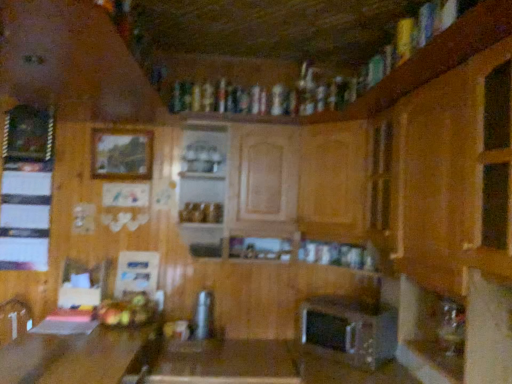
Question: Is wooden picture frame at upper left, the first picture frame in the right-to-left sequence, positioned with its back to shiny metallic fruit basket at lower center?

Choices:
 (A) yes
 (B) no

Answer: (B)

Question: Considering the relative sizes of wooden picture frame at upper left, the first picture frame in the right-to-left sequence, and shiny metallic fruit basket at lower center in the image provided, is wooden picture frame at upper left, the first picture frame in the right-to-left sequence, taller than shiny metallic fruit basket at lower center?

Choices:
 (A) no
 (B) yes

Answer: (B)

Question: From the image's perspective, does wooden picture frame at upper left, the first picture frame in the right-to-left sequence, appear lower than shiny metallic fruit basket at lower center?

Choices:
 (A) no
 (B) yes

Answer: (A)

Question: From a real-world perspective, is wooden picture frame at upper left, the first picture frame in the right-to-left sequence, physically below shiny metallic fruit basket at lower center?

Choices:
 (A) yes
 (B) no

Answer: (B)

Question: Is wooden picture frame at upper left, which is the second picture frame in left-to-right order, further to the viewer compared to shiny metallic fruit basket at lower center?

Choices:
 (A) no
 (B) yes

Answer: (B)

Question: Considering the positions of metallic silver toaster at center, placed as the first appliance when sorted from left to right, and wooden picture frame at upper left, which appears as the 2th picture frame when viewed from the right, in the image, is metallic silver toaster at center, placed as the first appliance when sorted from left to right, taller or shorter than wooden picture frame at upper left, which appears as the 2th picture frame when viewed from the right,?

Choices:
 (A) short
 (B) tall

Answer: (A)

Question: Does point (198, 294) appear closer or farther from the camera than point (15, 145)?

Choices:
 (A) closer
 (B) farther

Answer: (B)

Question: From the image's perspective, is metallic silver toaster at center, which is the second appliance in right-to-left order, positioned above or below wooden picture frame at upper left, positioned as the first picture frame in left-to-right order?

Choices:
 (A) below
 (B) above

Answer: (A)

Question: Looking at their shapes, would you say metallic silver toaster at center, which is the second appliance in right-to-left order, is wider or thinner than wooden picture frame at upper left, positioned as the first picture frame in left-to-right order?

Choices:
 (A) wide
 (B) thin

Answer: (A)

Question: In terms of height, does metallic silver toaster at center, placed as the first appliance when sorted from left to right, look taller or shorter compared to wooden table at lower left, which is the first table from left to right?

Choices:
 (A) tall
 (B) short

Answer: (B)

Question: Looking at the image, does metallic silver toaster at center, placed as the first appliance when sorted from left to right, seem bigger or smaller compared to wooden table at lower left, which is the first table from left to right?

Choices:
 (A) small
 (B) big

Answer: (A)

Question: Do you think metallic silver toaster at center, which is the second appliance in right-to-left order, is within wooden table at lower left, which ranks as the second table in right-to-left order, or outside of it?

Choices:
 (A) outside
 (B) inside

Answer: (A)

Question: From the image's perspective, is metallic silver toaster at center, which is the second appliance in right-to-left order, above or below wooden table at lower left, which is the first table from left to right?

Choices:
 (A) below
 (B) above

Answer: (B)

Question: Visually, is satin silver toaster at lower center, positioned as the 1th appliance in right-to-left order, positioned to the left or to the right of wooden table at lower left, which is the first table from left to right?

Choices:
 (A) left
 (B) right

Answer: (B)

Question: Is satin silver toaster at lower center, marked as the 2th appliance in a left-to-right arrangement, spatially inside wooden table at lower left, which is the first table from left to right, or outside of it?

Choices:
 (A) outside
 (B) inside

Answer: (A)